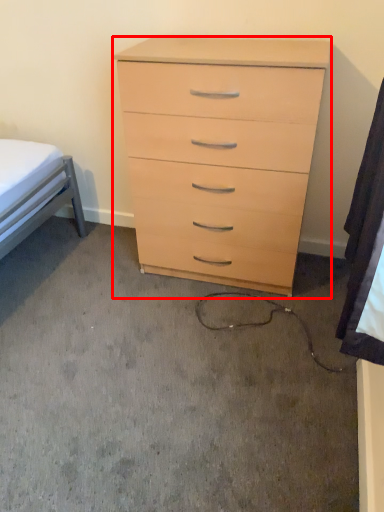
Question: Where is chest of drawers (annotated by the red box) located in relation to sheet in the image?

Choices:
 (A) left
 (B) right

Answer: (A)